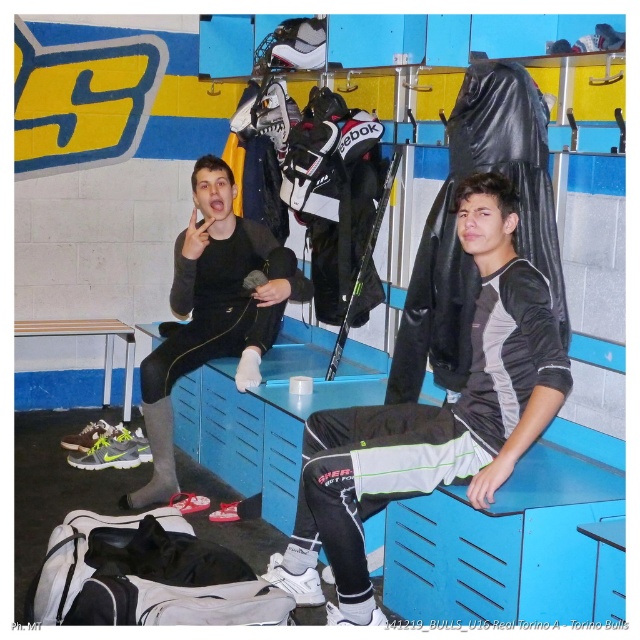
You are standing in the locker room and want to reach both points. Which point, point (508, 332) or point (250, 221), is closer to you?

Point (508, 332) is closer to you than point (250, 221).

You are standing in the locker room and need to find the black matte jacket at center. According to the coordinates provided, where exactly would you look to locate it?

The black matte jacket at center is located at coordinates point (432, 419).